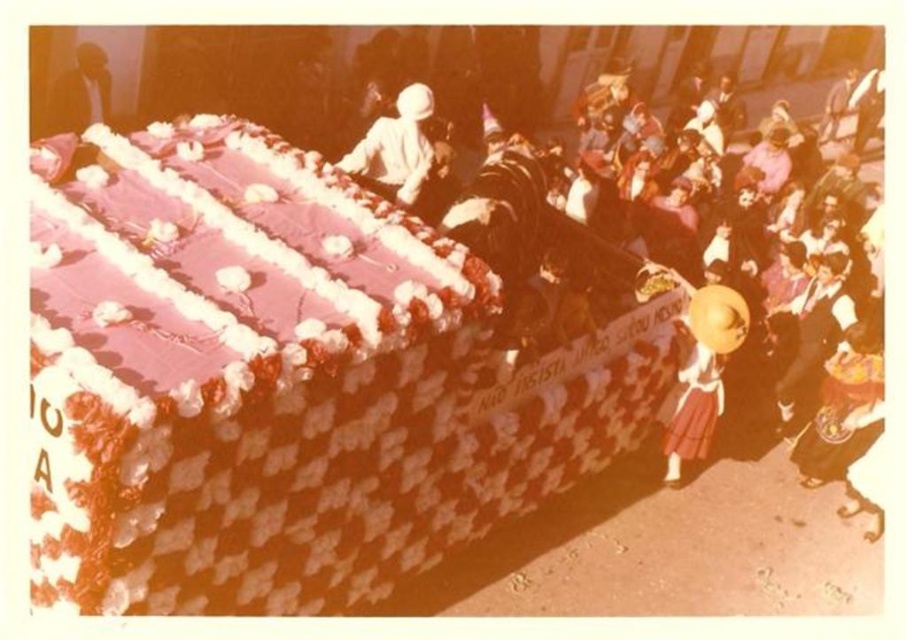
Between point (411, 148) and point (90, 113), which one is positioned in front?

Point (411, 148) is more forward.

Can you confirm if white clothed figure at center is bigger than dark brown leather jacket at upper left?

Indeed, white clothed figure at center has a larger size compared to dark brown leather jacket at upper left.

Who is more forward, (408, 161) or (64, 104)?

Point (408, 161)

What are the coordinates of `white clothed figure at center` in the screenshot? It's located at (396, 147).

Is yellow straw hat at center to the left of dark brown leather jacket at upper left from the viewer's perspective?

No, yellow straw hat at center is not to the left of dark brown leather jacket at upper left.

Can you confirm if yellow straw hat at center is positioned to the right of dark brown leather jacket at upper left?

Yes, yellow straw hat at center is to the right of dark brown leather jacket at upper left.

Does point (713, 348) come in front of point (45, 125)?

Yes, point (713, 348) is in front of point (45, 125).

At what (x,y) coordinates should I click in order to perform the action: click on yellow straw hat at center. Please return your answer as a coordinate pair (x, y). The width and height of the screenshot is (907, 640). Looking at the image, I should click on (701, 372).

Between yellow straw hat at center and white clothed figure at center, which one appears on the right side from the viewer's perspective?

yellow straw hat at center

Is yellow straw hat at center above white clothed figure at center?

Incorrect, yellow straw hat at center is not positioned above white clothed figure at center.

This screenshot has width=907, height=640. Describe the element at coordinates (701, 372) in the screenshot. I see `yellow straw hat at center` at that location.

The height and width of the screenshot is (640, 907). In order to click on yellow straw hat at center in this screenshot , I will do `click(701, 372)`.